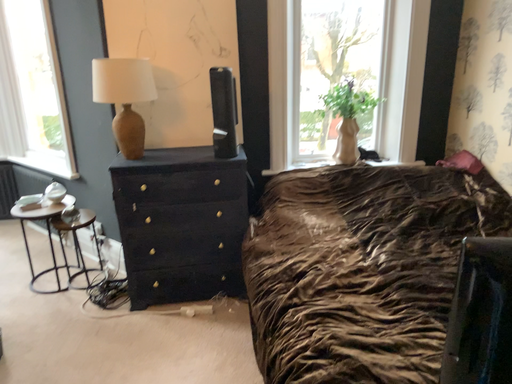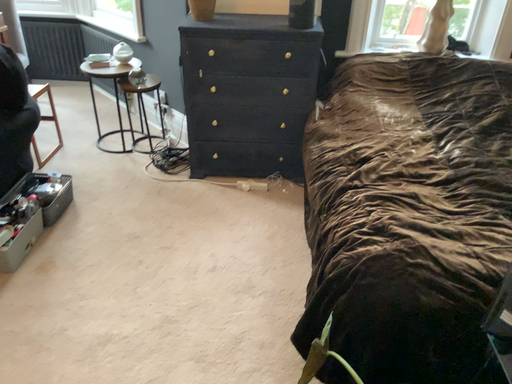
Question: Which way did the camera rotate in the video?

Choices:
 (A) rotated right
 (B) rotated left

Answer: (B)